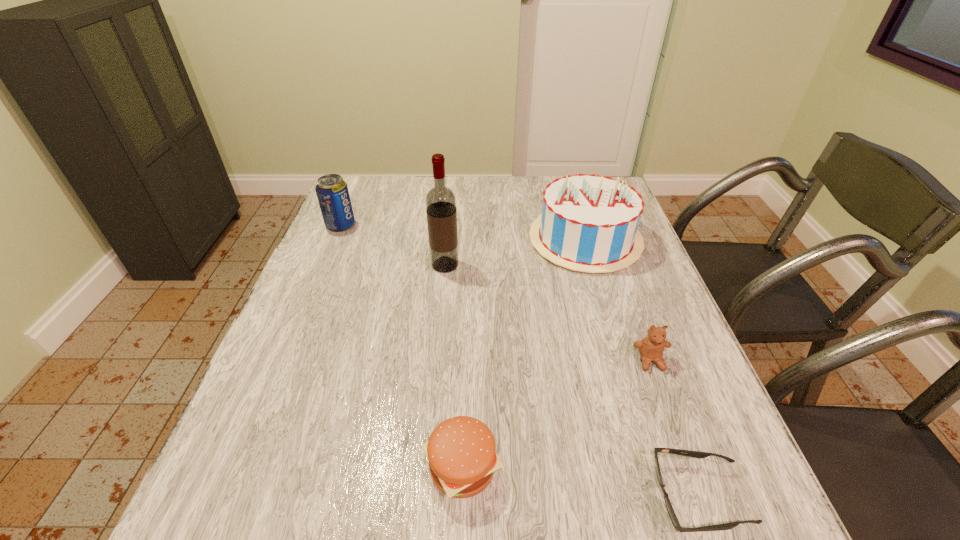
Where is `the tallest object`? The width and height of the screenshot is (960, 540). the tallest object is located at coordinates (441, 210).

Find the location of a particular element. This screenshot has height=540, width=960. the second tallest object is located at coordinates (589, 223).

The width and height of the screenshot is (960, 540). What are the coordinates of `the leftmost object` in the screenshot? It's located at (332, 192).

Locate an element on the screen. soda is located at coordinates coord(332,192).

Where is `teddy bear`? teddy bear is located at coordinates [651, 348].

You are a GUI agent. You are given a task and a screenshot of the screen. Output one action in this format:
    pyautogui.click(x=<x>, y=<y>)
    Task: Click on the hamburger
    
    Given the screenshot: What is the action you would take?
    pyautogui.click(x=461, y=451)

Locate an element on the screen. the shortest object is located at coordinates (696, 454).

Find the location of a particular element. vacant region located on the right of the tallest object is located at coordinates (504, 266).

The height and width of the screenshot is (540, 960). In order to click on free space located on the left of the second tallest object in this screenshot , I will do `click(498, 239)`.

Where is `vacant space positioned 0.060m on the back of the fourth shortest object`? vacant space positioned 0.060m on the back of the fourth shortest object is located at coordinates (348, 207).